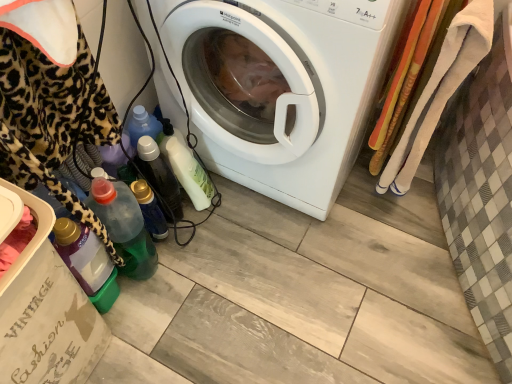
Locate an element on the screen. The width and height of the screenshot is (512, 384). green translucent bottle at lower left, which appears as the 5th bottle when viewed from the right is located at coordinates (87, 262).

Describe the element at coordinates (289, 89) in the screenshot. I see `white glossy washing machine at center` at that location.

This screenshot has height=384, width=512. I want to click on white glossy washing machine at center, so (289, 89).

This screenshot has width=512, height=384. Identify the location of matte cardboard box at lower left. (44, 308).

In order to face translucent plastic bottle at lower center, which is counted as the 5th bottle, starting from the left, should I rotate leftwards or rightwards?

To align with it, rotate left about 8.421°.

I want to click on translucent plastic bottle at lower left, arranged as the 3th bottle when viewed from the right, so click(x=150, y=209).

The image size is (512, 384). Find the location of `green translucent bottle at lower left, arranged as the first bottle when viewed from the left`. green translucent bottle at lower left, arranged as the first bottle when viewed from the left is located at coordinates (87, 262).

Can we say green translucent bottle at lower left, which appears as the 5th bottle when viewed from the right, lies outside translucent plastic bottle at lower left, which appears as the third bottle when viewed from the left?

That's correct, green translucent bottle at lower left, which appears as the 5th bottle when viewed from the right, is outside of translucent plastic bottle at lower left, which appears as the third bottle when viewed from the left.

Based on the photo, who is smaller, green translucent bottle at lower left, which appears as the 5th bottle when viewed from the right, or translucent plastic bottle at lower left, which appears as the third bottle when viewed from the left?

With smaller size is translucent plastic bottle at lower left, which appears as the third bottle when viewed from the left.

From the picture: Considering the sizes of green translucent bottle at lower left, arranged as the first bottle when viewed from the left, and translucent plastic bottle at lower left, which appears as the third bottle when viewed from the left, in the image, is green translucent bottle at lower left, arranged as the first bottle when viewed from the left, wider or thinner than translucent plastic bottle at lower left, which appears as the third bottle when viewed from the left,?

In the image, green translucent bottle at lower left, arranged as the first bottle when viewed from the left, appears to be wider than translucent plastic bottle at lower left, which appears as the third bottle when viewed from the left.

Is green translucent bottle at lower left, which appears as the 5th bottle when viewed from the right, further to the viewer compared to translucent plastic bottle at lower left, arranged as the 3th bottle when viewed from the right?

No, it is in front of translucent plastic bottle at lower left, arranged as the 3th bottle when viewed from the right.

Does matte cardboard box at lower left contain translucent plastic bottle at lower left, arranged as the 3th bottle when viewed from the right?

That's incorrect, translucent plastic bottle at lower left, arranged as the 3th bottle when viewed from the right, is not inside matte cardboard box at lower left.

Is matte cardboard box at lower left next to translucent plastic bottle at lower left, which appears as the third bottle when viewed from the left?

No, matte cardboard box at lower left is not in contact with translucent plastic bottle at lower left, which appears as the third bottle when viewed from the left.

From a real-world perspective, is matte cardboard box at lower left located higher than translucent plastic bottle at lower left, which appears as the third bottle when viewed from the left?

Yes, from a real-world perspective, matte cardboard box at lower left is above translucent plastic bottle at lower left, which appears as the third bottle when viewed from the left.

From their relative heights in the image, would you say translucent plastic bottle at lower left, which appears as the third bottle when viewed from the left, is taller or shorter than translucent plastic bottle at lower left, the 2th bottle when ordered from right to left?

translucent plastic bottle at lower left, which appears as the third bottle when viewed from the left, is shorter than translucent plastic bottle at lower left, the 2th bottle when ordered from right to left.

Is translucent plastic bottle at lower left, arranged as the 3th bottle when viewed from the right, bigger or smaller than translucent plastic bottle at lower left, the 2th bottle when ordered from right to left?

In the image, translucent plastic bottle at lower left, arranged as the 3th bottle when viewed from the right, appears to be smaller than translucent plastic bottle at lower left, the 2th bottle when ordered from right to left.

Which object is thinner, translucent plastic bottle at lower left, which appears as the third bottle when viewed from the left, or translucent plastic bottle at lower left, the 2th bottle when ordered from right to left?

translucent plastic bottle at lower left, which appears as the third bottle when viewed from the left, is thinner.

Based on their sizes in the image, would you say white glossy washing machine at center is bigger or smaller than translucent plastic bottle at lower left, which appears as the third bottle when viewed from the left?

white glossy washing machine at center is bigger than translucent plastic bottle at lower left, which appears as the third bottle when viewed from the left.

Is white glossy washing machine at center not close to translucent plastic bottle at lower left, arranged as the 3th bottle when viewed from the right?

No, white glossy washing machine at center is not far from translucent plastic bottle at lower left, arranged as the 3th bottle when viewed from the right.

Is white glossy washing machine at center further to camera compared to translucent plastic bottle at lower left, arranged as the 3th bottle when viewed from the right?

No, white glossy washing machine at center is closer to the camera.

From a real-world perspective, is white glossy washing machine at center over translucent plastic bottle at lower left, arranged as the 3th bottle when viewed from the right?

Correct, in the physical world, white glossy washing machine at center is higher than translucent plastic bottle at lower left, arranged as the 3th bottle when viewed from the right.

Is there a large distance between translucent plastic bottle at lower left, the second bottle positioned from the left, and white glossy washing machine at center?

No, there isn't a large distance between translucent plastic bottle at lower left, the second bottle positioned from the left, and white glossy washing machine at center.

Is translucent plastic bottle at lower left, the second bottle positioned from the left, wider than white glossy washing machine at center?

Incorrect, the width of translucent plastic bottle at lower left, the second bottle positioned from the left, does not surpass that of white glossy washing machine at center.

Locate an element on the screen. the 2nd bottle behind the white glossy washing machine at center is located at coordinates (124, 226).

Considering the relative sizes of translucent plastic bottle at lower left, the fourth bottle from the right, and white glossy washing machine at center in the image provided, is translucent plastic bottle at lower left, the fourth bottle from the right, smaller than white glossy washing machine at center?

Correct, translucent plastic bottle at lower left, the fourth bottle from the right, occupies less space than white glossy washing machine at center.

Is point (98, 185) farther from camera compared to point (14, 378)?

Yes, point (98, 185) is behind point (14, 378).

Which is in front, translucent plastic bottle at lower left, the fourth bottle from the right, or matte cardboard box at lower left?

matte cardboard box at lower left is more forward.

Where is `cardboard box that appears below the translucent plastic bottle at lower left, the fourth bottle from the right (from the image's perspective)`? The image size is (512, 384). cardboard box that appears below the translucent plastic bottle at lower left, the fourth bottle from the right (from the image's perspective) is located at coordinates (44, 308).

From the image's perspective, is translucent plastic bottle at lower left, arranged as the 3th bottle when viewed from the right, on matte cardboard box at lower left?

Yes, from the image's perspective, translucent plastic bottle at lower left, arranged as the 3th bottle when viewed from the right, is over matte cardboard box at lower left.

Considering the positions of point (154, 200) and point (99, 345), is point (154, 200) closer or farther from the camera than point (99, 345)?

Clearly, point (154, 200) is more distant from the camera than point (99, 345).

Between translucent plastic bottle at lower left, arranged as the 3th bottle when viewed from the right, and matte cardboard box at lower left, which one has larger width?

matte cardboard box at lower left.

At what (x,y) coordinates should I click in order to perform the action: click on cardboard box that appears in front of the translucent plastic bottle at lower left, arranged as the 3th bottle when viewed from the right. Please return your answer as a coordinate pair (x, y). The height and width of the screenshot is (384, 512). Looking at the image, I should click on (44, 308).

Which bottle is the 3rd one when counting from the front of the translucent plastic bottle at lower left, which appears as the third bottle when viewed from the left? Please provide its 2D coordinates.

[(87, 262)]

Starting from the matte cardboard box at lower left, which bottle is the 3rd one to the right? Please provide its 2D coordinates.

[(150, 209)]

Based on their spatial positions, is green translucent bottle at lower left, which appears as the 5th bottle when viewed from the right, or translucent plastic bottle at lower center, placed as the 1th bottle when sorted from right to left, further from matte cardboard box at lower left?

The object further to matte cardboard box at lower left is translucent plastic bottle at lower center, placed as the 1th bottle when sorted from right to left.

Based on their spatial positions, is translucent plastic bottle at lower left, which appears as the third bottle when viewed from the left, or translucent plastic bottle at lower center, placed as the 1th bottle when sorted from right to left, closer to green translucent bottle at lower left, which appears as the 5th bottle when viewed from the right?

Among the two, translucent plastic bottle at lower left, which appears as the third bottle when viewed from the left, is located nearer to green translucent bottle at lower left, which appears as the 5th bottle when viewed from the right.

Looking at the image, which one is located closer to white glossy washing machine at center, translucent plastic bottle at lower left, the fourth bottle from the right, or green translucent bottle at lower left, which appears as the 5th bottle when viewed from the right?

translucent plastic bottle at lower left, the fourth bottle from the right.

Considering their positions, is white glossy washing machine at center positioned further to translucent plastic bottle at lower left, the 4th bottle in the left-to-right sequence, than matte cardboard box at lower left?

Among the two, matte cardboard box at lower left is located further to translucent plastic bottle at lower left, the 4th bottle in the left-to-right sequence.

Which object lies nearer to the anchor point translucent plastic bottle at lower center, placed as the 1th bottle when sorted from right to left, translucent plastic bottle at lower left, arranged as the 3th bottle when viewed from the right, or white glossy washing machine at center?

Among the two, translucent plastic bottle at lower left, arranged as the 3th bottle when viewed from the right, is located nearer to translucent plastic bottle at lower center, placed as the 1th bottle when sorted from right to left.

Looking at the image, which one is located further to translucent plastic bottle at lower center, which is counted as the 5th bottle, starting from the left, white glossy washing machine at center or translucent plastic bottle at lower left, the 2th bottle when ordered from right to left?

Based on the image, white glossy washing machine at center appears to be further to translucent plastic bottle at lower center, which is counted as the 5th bottle, starting from the left.

From the image, which object appears to be farther from translucent plastic bottle at lower left, the fourth bottle from the right, matte cardboard box at lower left or white glossy washing machine at center?

Among the two, white glossy washing machine at center is located further to translucent plastic bottle at lower left, the fourth bottle from the right.

Which object lies further to the anchor point translucent plastic bottle at lower center, placed as the 1th bottle when sorted from right to left, translucent plastic bottle at lower left, which appears as the third bottle when viewed from the left, or translucent plastic bottle at lower left, the second bottle positioned from the left?

translucent plastic bottle at lower left, the second bottle positioned from the left, is further to translucent plastic bottle at lower center, placed as the 1th bottle when sorted from right to left.

This screenshot has height=384, width=512. I want to click on bottle between translucent plastic bottle at lower center, placed as the 1th bottle when sorted from right to left, and translucent plastic bottle at lower left, which appears as the third bottle when viewed from the left, vertically, so click(x=159, y=177).

Find the location of a particular element. bottle between green translucent bottle at lower left, which appears as the 5th bottle when viewed from the right, and translucent plastic bottle at lower left, the 2th bottle when ordered from right to left, in the front-back direction is located at coordinates click(x=124, y=226).

Locate an element on the screen. The image size is (512, 384). washing machine located between matte cardboard box at lower left and translucent plastic bottle at lower center, placed as the 1th bottle when sorted from right to left, in the depth direction is located at coordinates (289, 89).

The height and width of the screenshot is (384, 512). Identify the location of bottle between translucent plastic bottle at lower left, the fourth bottle from the right, and translucent plastic bottle at lower left, which appears as the third bottle when viewed from the left, from front to back. (159, 177).